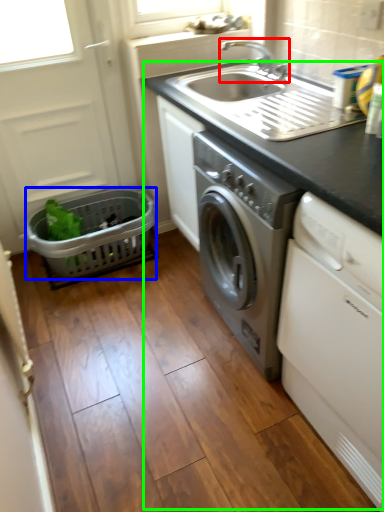
Question: Estimate the real-world distances between objects in this image. Which object is farther from tap (highlighted by a red box), basket (highlighted by a blue box) or appliance (highlighted by a green box)?

Choices:
 (A) basket
 (B) appliance

Answer: (A)